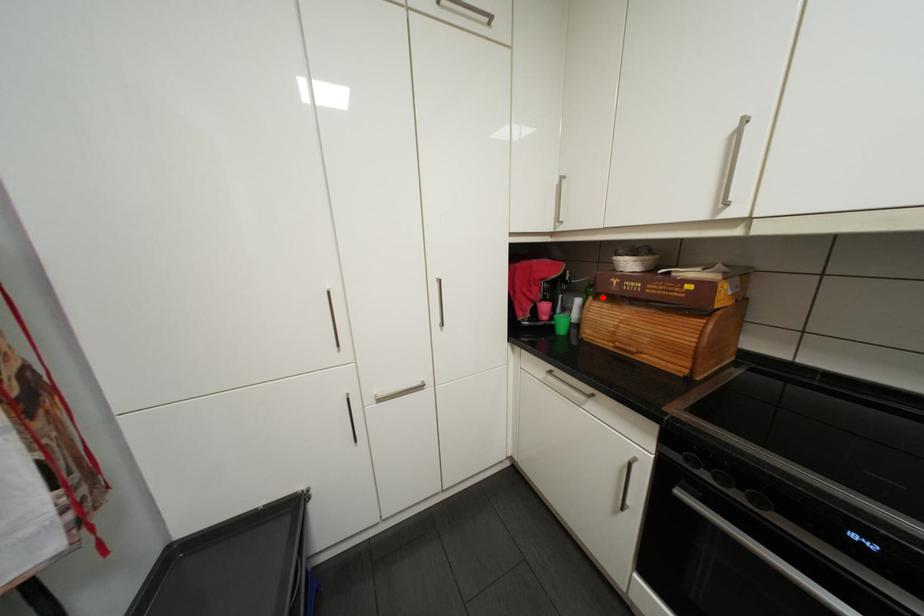
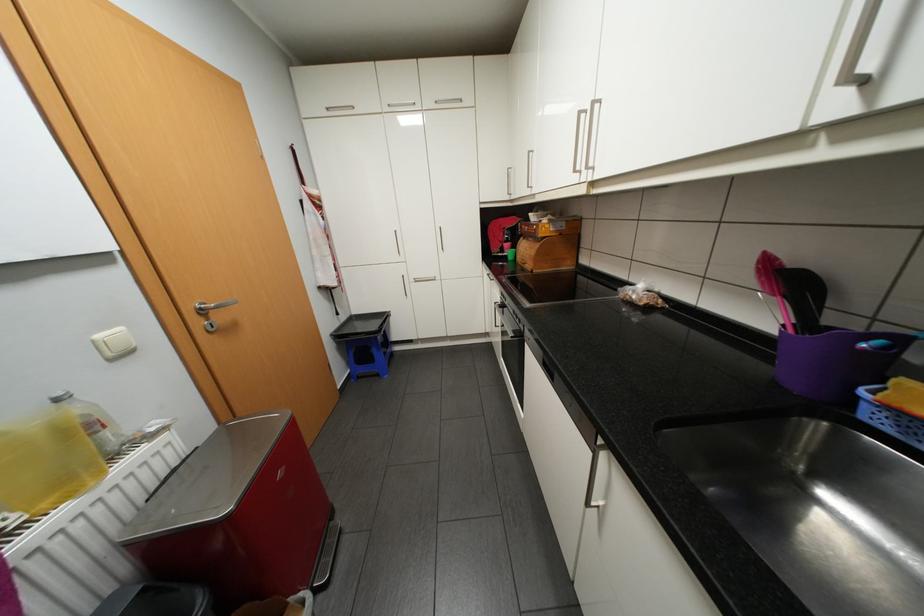
The point at the highlighted location is marked in the first image. Where is the corresponding point in the second image?

(531, 237)